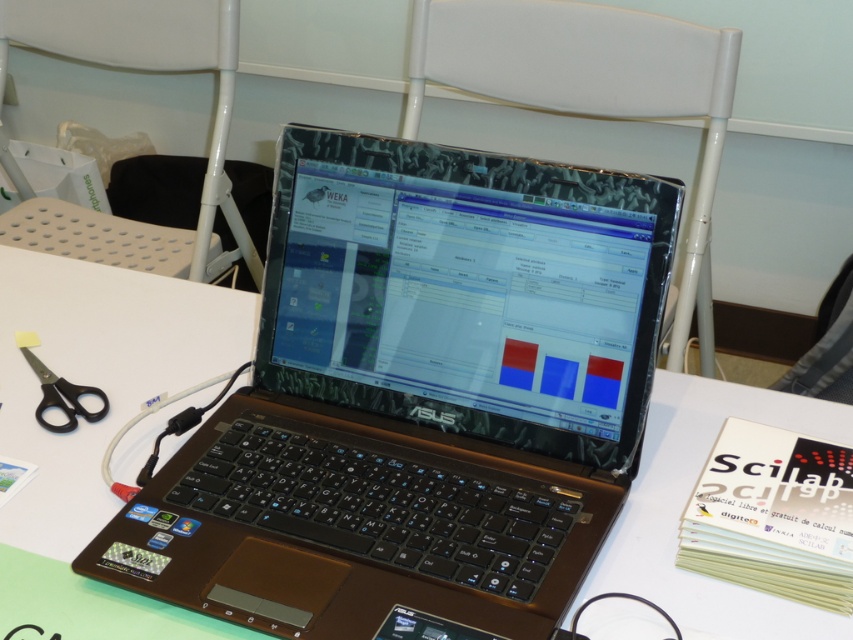
You are organizing a tech fair and need to arrange the brown matte laptop at center and the white plastic chair at upper center. Given their sizes, which object should you place first in a limited space to ensure both fit comfortably?

The brown matte laptop at center has a smaller size compared to the white plastic chair at upper center, so you should place the white plastic chair at upper center first to accommodate its larger size before fitting the smaller laptop into the remaining space.

You are sitting in the white plastic chair at upper center and need to pick up the black plastic scissors at lower left. Which direction should you turn to face the scissors?

You should turn to your right to face the black plastic scissors at lower left because the white plastic chair at upper center is to the left of the scissors.